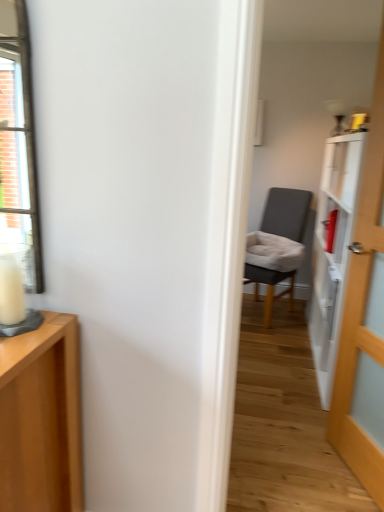
The height and width of the screenshot is (512, 384). I want to click on free area behind wooden door at right, so click(306, 426).